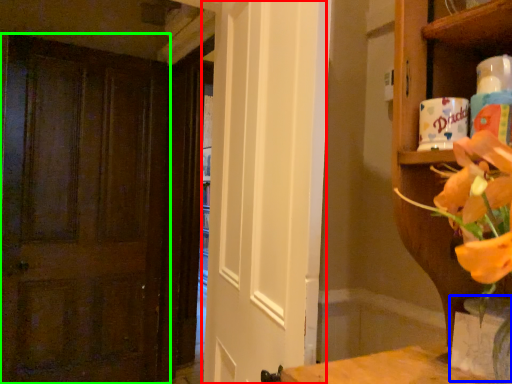
Question: Based on their relative distances, which object is farther from screen door (highlighted by a red box)? Choose from vase (highlighted by a blue box) and door (highlighted by a green box).

Choices:
 (A) vase
 (B) door

Answer: (B)